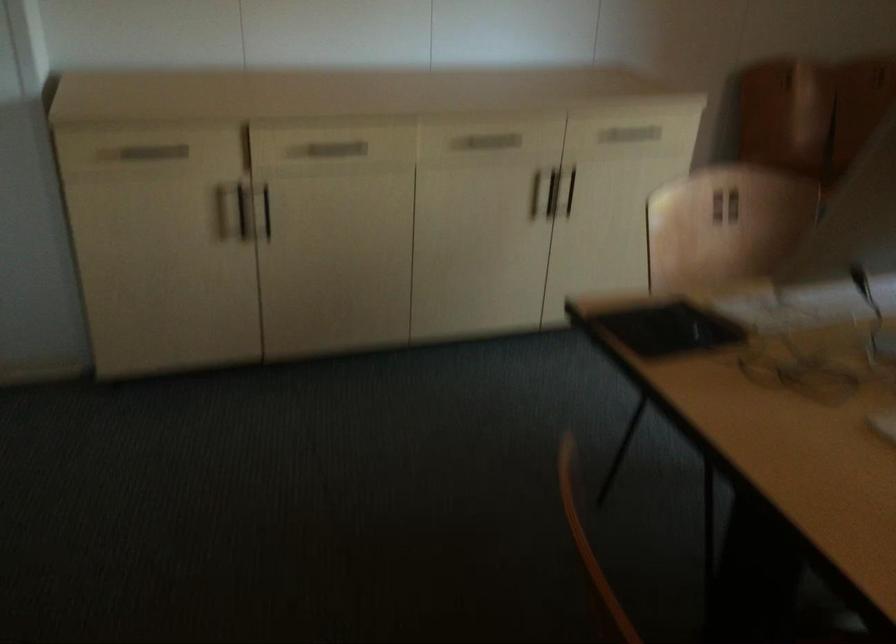
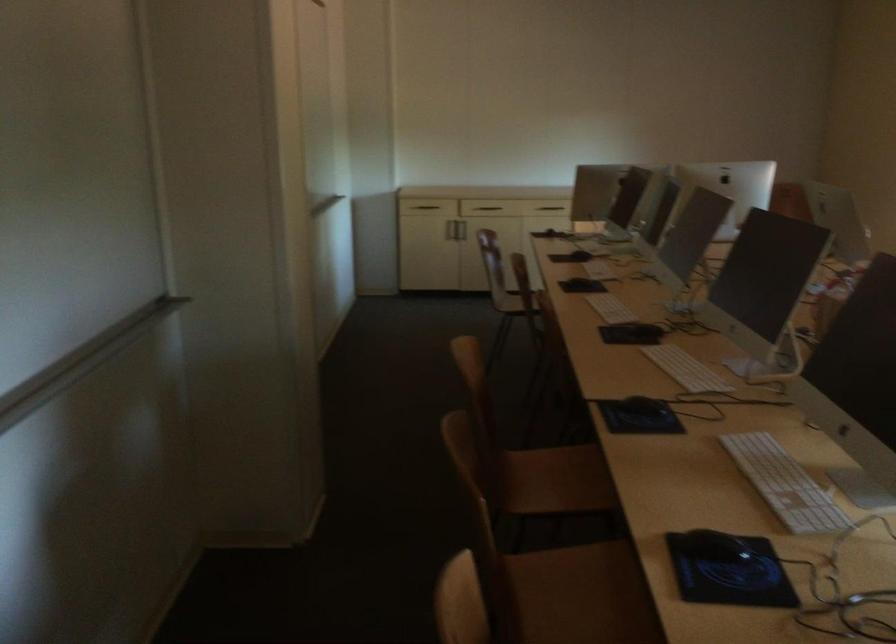
The point at (264, 211) is marked in the first image. Where is the corresponding point in the second image?

(463, 214)